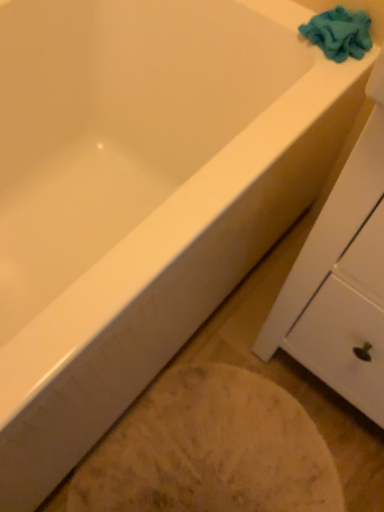
Question: Is white glossy bathtub at lower left wider or thinner than blue fuzzy towel at upper right?

Choices:
 (A) wide
 (B) thin

Answer: (A)

Question: From a real-world perspective, is white glossy bathtub at lower left positioned above or below blue fuzzy towel at upper right?

Choices:
 (A) below
 (B) above

Answer: (A)

Question: Based on their relative distances, which object is nearer to the white glossy bathtub at lower left?

Choices:
 (A) blue fuzzy towel at upper right
 (B) white matte cabinet at upper right

Answer: (B)

Question: Which object is positioned closest to the blue fuzzy towel at upper right?

Choices:
 (A) white matte cabinet at upper right
 (B) white glossy bathtub at lower left

Answer: (A)